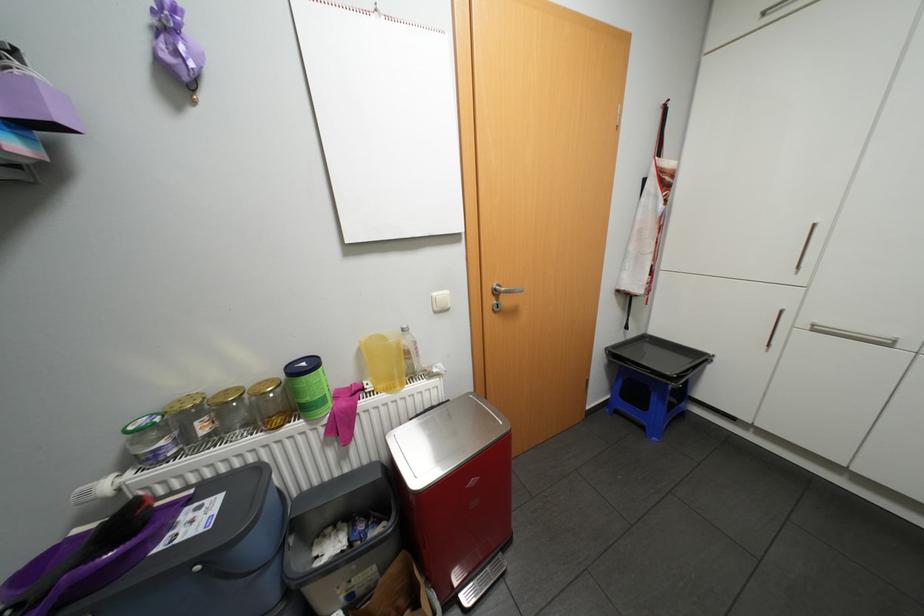
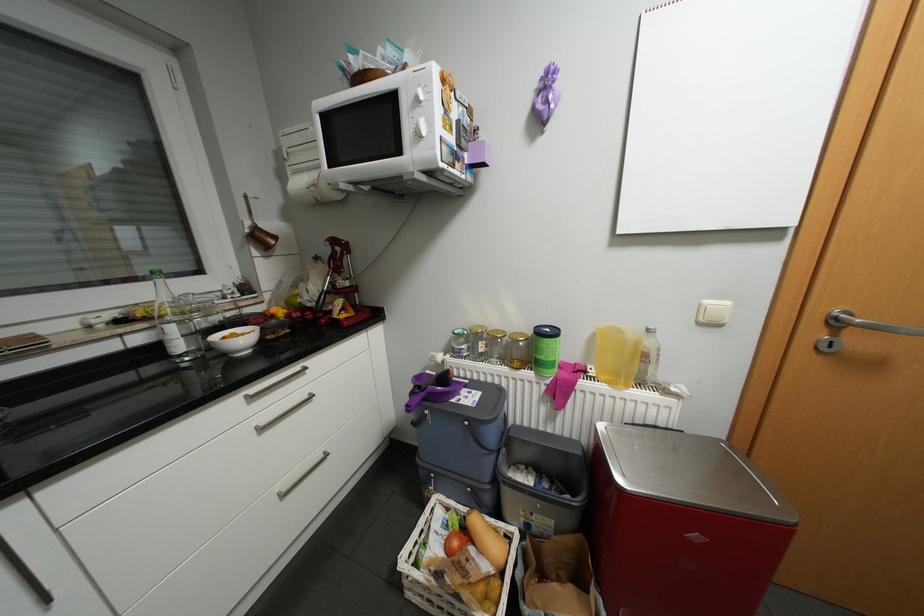
In the second image, find the point that corresponds to the point at 507,424 in the first image.

(784, 504)